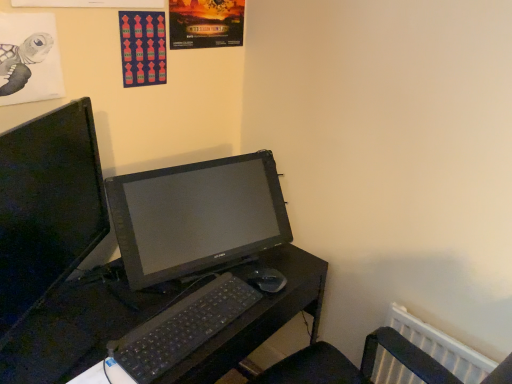
Question: Is red fabric poster at upper center, acting as the second poster page starting from the left, in front of or behind black plastic mouse at lower center in the image?

Choices:
 (A) behind
 (B) front

Answer: (B)

Question: From their relative heights in the image, would you say red fabric poster at upper center, placed as the second poster page when sorted from right to left, is taller or shorter than black plastic mouse at lower center?

Choices:
 (A) short
 (B) tall

Answer: (B)

Question: Considering the real-world distances, which object is closest to the black plastic keyboard at center?

Choices:
 (A) black plastic mouse at lower center
 (B) matte paper poster at upper center, marked as the 1th poster page in a right-to-left arrangement
 (C) red fabric poster at upper center, acting as the second poster page starting from the left
 (D) matte black monitor at left
 (E) matte paper turtle at upper left, which appears as the 1th poster page when viewed from the left

Answer: (A)

Question: Which object is positioned closest to the matte paper turtle at upper left, which appears as the 1th poster page when viewed from the left?

Choices:
 (A) matte paper poster at upper center, marked as the 1th poster page in a right-to-left arrangement
 (B) black plastic keyboard at center
 (C) black plastic desk at center
 (D) matte black monitor at left
 (E) black plastic mouse at lower center

Answer: (D)